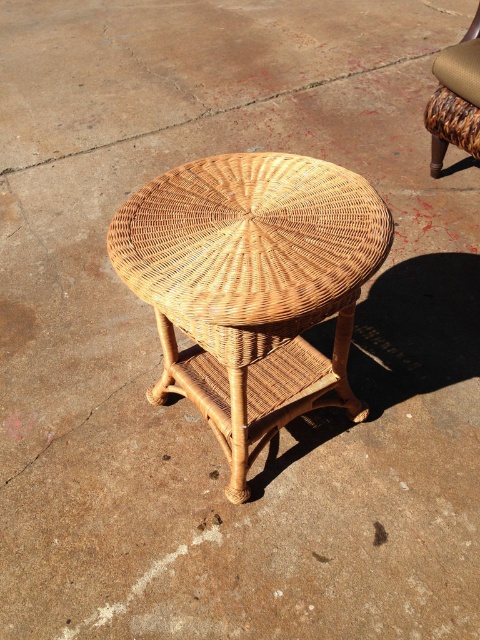
You are setting up a small outdoor dining area and have both the natural wicker side table at center and the woven brown chair at center. If you want to place a tall flower vase on the table, which object should you choose to ensure the vase is visible over the chair?

The natural wicker side table at center is much taller than the woven brown chair at center, so placing the tall flower vase on the natural wicker side table at center will ensure it is visible over the woven brown chair at center.

You are sitting on the woven brown chair at center and want to place a book on the natural wicker side table at center. Can you reach the table from your current position without moving your chair?

The natural wicker side table at center is in front of the woven brown chair at center, so yes, you can reach the table from your current position without moving your chair.

You are planning to place a small potted plant between the natural wicker side table at center and the woven brown chair at center. The plant requires a minimum of 4 feet of space to grow properly. Based on the scene, will there be enough space between them for the plant?

The natural wicker side table at center is 3.94 feet from the woven brown chair at center, which is slightly less than the required 4 feet. Therefore, there isn not enough space for the plant to grow properly.